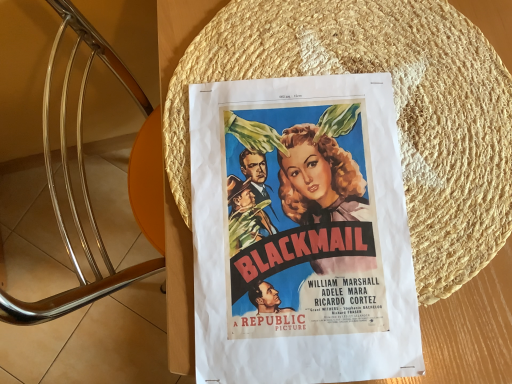
Question: Is woven straw hat at center wider or thinner than matte paper poster at center?

Choices:
 (A) wide
 (B) thin

Answer: (A)

Question: Would you say woven straw hat at center is inside or outside matte paper poster at center?

Choices:
 (A) inside
 (B) outside

Answer: (A)

Question: From the image's perspective, is woven straw hat at center located above or below matte paper poster at center?

Choices:
 (A) above
 (B) below

Answer: (A)

Question: From the image's perspective, is matte paper poster at center above or below woven straw hat at center?

Choices:
 (A) below
 (B) above

Answer: (A)

Question: Which is correct: matte paper poster at center is inside woven straw hat at center, or outside of it?

Choices:
 (A) inside
 (B) outside

Answer: (A)

Question: Is point (408, 327) closer or farther from the camera than point (420, 49)?

Choices:
 (A) farther
 (B) closer

Answer: (B)

Question: Considering the positions of matte paper poster at center and woven straw hat at center in the image, is matte paper poster at center wider or thinner than woven straw hat at center?

Choices:
 (A) wide
 (B) thin

Answer: (B)